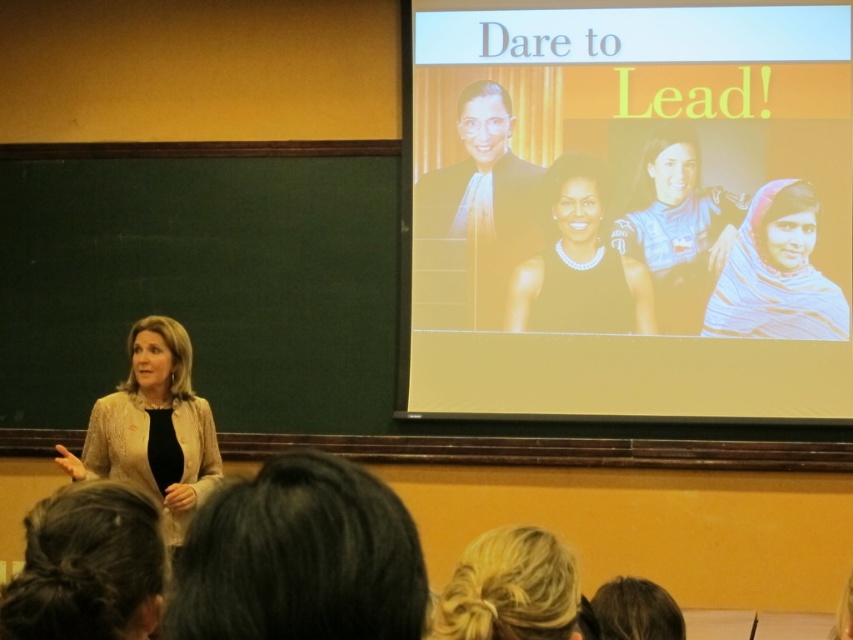
You are an attendee sitting in the front row of the presentation. You notice two points marked in the image. The first point is at coordinate [97,432] and the second point is at coordinate [654,275]. Which of these two points is closer to you?

The point at coordinate [97,432] is closer to you than the point at coordinate [654,275].

Based on the photo, you are an attendee sitting in the front row of the presentation. You notice two items in the image that are of interest to you. The first is the dark brown hair at lower center and the second is the blue fabric at center. Which of these two items is shorter in height?

The dark brown hair at lower center is shorter in height than the blue fabric at center because the dark brown hair at lower center is not as tall as blue fabric at center.